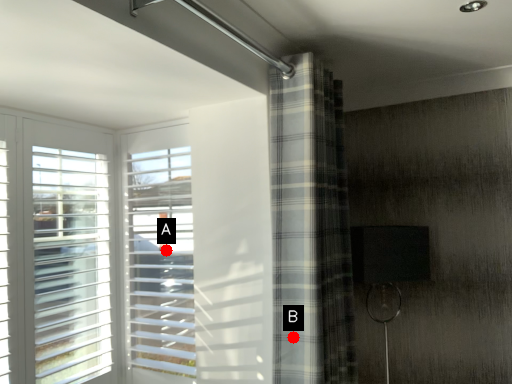
Question: Two points are circled on the image, labeled by A and B beside each circle. Which of the following is the closest to the observer?

Choices:
 (A) A is closer
 (B) B is closer

Answer: (B)